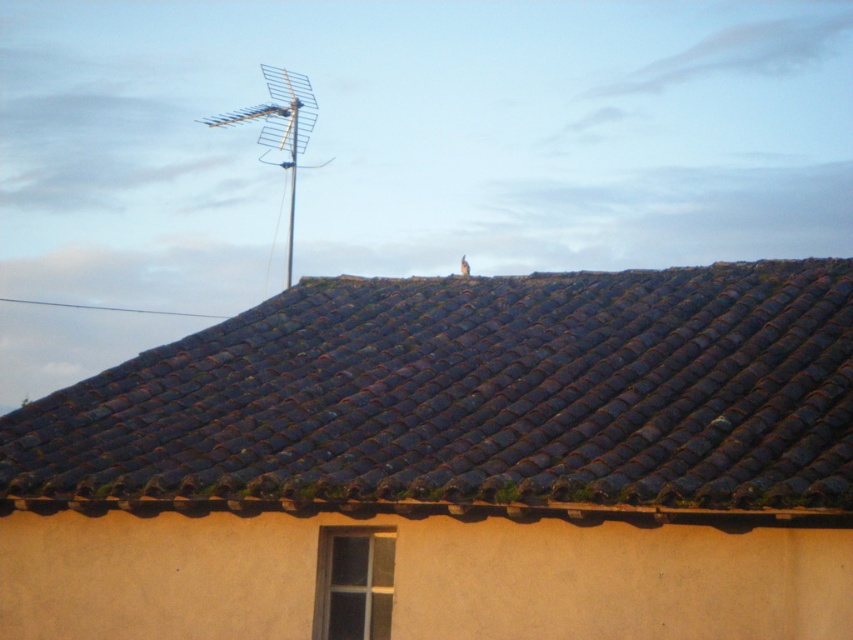
You are a technician assessing the roof for maintenance. You notice the brown tile roof at upper center and the metallic antenna at upper center. Which object is wider?

The brown tile roof at upper center is wider than the metallic antenna at upper center, as its width surpasses the antenna.

You are standing on the ground looking up at the roof. There is a point marked at coordinates (476, 396). What object is located at that point?

The point at coordinates (476, 396) marks the brown tile roof at upper center.